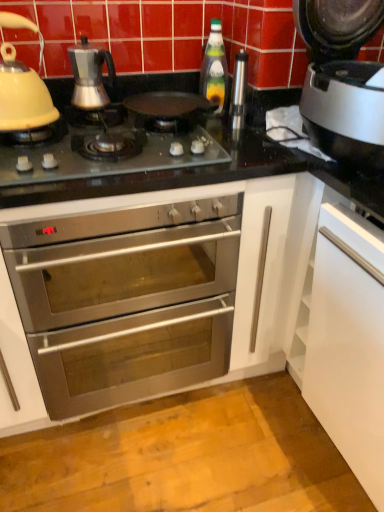
Consider the image. In order to face stainless steel oven at center, should I rotate leftwards or rightwards?

You should rotate left by 9.328 degrees.

Image resolution: width=384 pixels, height=512 pixels. What are the coordinates of `black glass gas stove at center` in the screenshot? It's located at (108, 150).

The width and height of the screenshot is (384, 512). What do you see at coordinates (90, 75) in the screenshot?
I see `satin silver coffee maker at upper left, which is counted as the first kitchen appliance, starting from the right` at bounding box center [90, 75].

This screenshot has height=512, width=384. In order to click on green glass bottle at center in this screenshot , I will do `click(214, 68)`.

This screenshot has width=384, height=512. I want to click on matte yellow kettle at left, the first kitchen appliance when ordered from left to right, so click(x=22, y=95).

This screenshot has width=384, height=512. Identify the location of white glossy dishwasher at lower right, the 2th appliance in the left-to-right sequence. (349, 343).

Considering the sizes of objects black glass gas stove at center and satin silver thermos at upper right, which ranks as the 1th appliance in left-to-right order, in the image provided, who is thinner, black glass gas stove at center or satin silver thermos at upper right, which ranks as the 1th appliance in left-to-right order,?

satin silver thermos at upper right, which ranks as the 1th appliance in left-to-right order, is thinner.

Can you confirm if black glass gas stove at center is smaller than satin silver thermos at upper right, acting as the 2th appliance starting from the right?

Actually, black glass gas stove at center might be larger than satin silver thermos at upper right, acting as the 2th appliance starting from the right.

Is black glass gas stove at center turned away from satin silver thermos at upper right, which ranks as the 1th appliance in left-to-right order?

No.

Between black glass gas stove at center and satin silver thermos at upper right, which ranks as the 1th appliance in left-to-right order, which one appears on the left side from the viewer's perspective?

From the viewer's perspective, black glass gas stove at center appears more on the left side.

How different are the orientations of satin silver thermos at upper right, the first appliance in the top-to-bottom sequence, and stainless steel oven at center in degrees?

They differ by 0.00612 degrees in their facing directions.

From a real-world perspective, is satin silver thermos at upper right, the 2th appliance in the bottom-to-top sequence, located beneath stainless steel oven at center?

No, from a real-world perspective, satin silver thermos at upper right, the 2th appliance in the bottom-to-top sequence, is not beneath stainless steel oven at center.

Is satin silver thermos at upper right, acting as the 2th appliance starting from the right, not inside stainless steel oven at center?

satin silver thermos at upper right, acting as the 2th appliance starting from the right, is positioned outside stainless steel oven at center.

Is satin silver thermos at upper right, acting as the 2th appliance starting from the right, next to stainless steel oven at center?

Result: No, satin silver thermos at upper right, acting as the 2th appliance starting from the right, is not with stainless steel oven at center.

Is stainless steel oven at center beside satin silver thermos at upper right, the first appliance in the top-to-bottom sequence?

There is a gap between stainless steel oven at center and satin silver thermos at upper right, the first appliance in the top-to-bottom sequence.

Looking at the image, does stainless steel oven at center seem bigger or smaller compared to satin silver thermos at upper right, acting as the 2th appliance starting from the right?

Clearly, stainless steel oven at center is larger in size than satin silver thermos at upper right, acting as the 2th appliance starting from the right.

Based on the photo, which object is further away from the camera, stainless steel oven at center or satin silver thermos at upper right, the first appliance in the top-to-bottom sequence?

Positioned behind is satin silver thermos at upper right, the first appliance in the top-to-bottom sequence.

Which object is positioned more to the right, stainless steel oven at center or satin silver thermos at upper right, acting as the 2th appliance starting from the right?

satin silver thermos at upper right, acting as the 2th appliance starting from the right.

Considering the relative positions of black glass gas stove at center and satin silver coffee maker at upper left, which is counted as the first kitchen appliance, starting from the right, in the image provided, is black glass gas stove at center in front of satin silver coffee maker at upper left, which is counted as the first kitchen appliance, starting from the right,?

Yes, it is.

Identify the location of gas stove below the satin silver coffee maker at upper left, which is the 2th kitchen appliance from left to right (from the image's perspective). (108, 150).

Is black glass gas stove at center far away from satin silver coffee maker at upper left, which is counted as the first kitchen appliance, starting from the right?

Actually, black glass gas stove at center and satin silver coffee maker at upper left, which is counted as the first kitchen appliance, starting from the right, are a little close together.

Who is smaller, matte yellow kettle at left, the first kitchen appliance when ordered from left to right, or black glass gas stove at center?

Smaller between the two is matte yellow kettle at left, the first kitchen appliance when ordered from left to right.

From the image's perspective, does matte yellow kettle at left, placed as the second kitchen appliance when sorted from right to left, appear lower than black glass gas stove at center?

Incorrect, from the image's perspective, matte yellow kettle at left, placed as the second kitchen appliance when sorted from right to left, is higher than black glass gas stove at center.

Between matte yellow kettle at left, the first kitchen appliance when ordered from left to right, and black glass gas stove at center, which one is positioned behind?

Positioned behind is matte yellow kettle at left, the first kitchen appliance when ordered from left to right.

Considering the sizes of matte yellow kettle at left, the first kitchen appliance when ordered from left to right, and black glass gas stove at center in the image, is matte yellow kettle at left, the first kitchen appliance when ordered from left to right, taller or shorter than black glass gas stove at center?

matte yellow kettle at left, the first kitchen appliance when ordered from left to right, is taller than black glass gas stove at center.

Is green glass bottle at center not near matte yellow kettle at left, placed as the second kitchen appliance when sorted from right to left?

No, green glass bottle at center is not far away from matte yellow kettle at left, placed as the second kitchen appliance when sorted from right to left.

From the image's perspective, is green glass bottle at center on top of matte yellow kettle at left, placed as the second kitchen appliance when sorted from right to left?

Correct, green glass bottle at center appears higher than matte yellow kettle at left, placed as the second kitchen appliance when sorted from right to left, in the image.

Is green glass bottle at center aimed at matte yellow kettle at left, placed as the second kitchen appliance when sorted from right to left?

No, green glass bottle at center does not turn towards matte yellow kettle at left, placed as the second kitchen appliance when sorted from right to left.

Would you say white glossy dishwasher at lower right, the second appliance viewed from the top, is inside or outside matte yellow kettle at left, placed as the second kitchen appliance when sorted from right to left?

white glossy dishwasher at lower right, the second appliance viewed from the top, is spatially situated outside matte yellow kettle at left, placed as the second kitchen appliance when sorted from right to left.

Which of these two, white glossy dishwasher at lower right, the 1th appliance in the bottom-to-top sequence, or matte yellow kettle at left, placed as the second kitchen appliance when sorted from right to left, is thinner?

matte yellow kettle at left, placed as the second kitchen appliance when sorted from right to left.

From the image's perspective, would you say white glossy dishwasher at lower right, the 2th appliance in the left-to-right sequence, is positioned over matte yellow kettle at left, placed as the second kitchen appliance when sorted from right to left?

No.

You are a GUI agent. You are given a task and a screenshot of the screen. Output one action in this format:
    pyautogui.click(x=<x>, y=<y>)
    Task: Click on the appliance behind the black glass gas stove at center
    This screenshot has height=512, width=384.
    Given the screenshot: What is the action you would take?
    pyautogui.click(x=239, y=91)

Where is `cabinetry on the left of satin silver thermos at upper right, the 2th appliance in the bottom-to-top sequence`? cabinetry on the left of satin silver thermos at upper right, the 2th appliance in the bottom-to-top sequence is located at coordinates (148, 298).

Which object lies further to the anchor point matte yellow kettle at left, placed as the second kitchen appliance when sorted from right to left, satin silver coffee maker at upper left, which is the 2th kitchen appliance from left to right, or white glossy dishwasher at lower right, marked as the 1th appliance in a right-to-left arrangement?

white glossy dishwasher at lower right, marked as the 1th appliance in a right-to-left arrangement.

Estimate the real-world distances between objects in this image. Which object is further from stainless steel oven at center, black glass gas stove at center or satin silver thermos at upper right, acting as the 2th appliance starting from the right?

→ Based on the image, satin silver thermos at upper right, acting as the 2th appliance starting from the right, appears to be further to stainless steel oven at center.

Based on their spatial positions, is matte yellow kettle at left, the first kitchen appliance when ordered from left to right, or black glass gas stove at center closer to white glossy dishwasher at lower right, the 1th appliance in the bottom-to-top sequence?

The object closer to white glossy dishwasher at lower right, the 1th appliance in the bottom-to-top sequence, is black glass gas stove at center.

Based on their spatial positions, is white glossy dishwasher at lower right, the 2th appliance in the left-to-right sequence, or green glass bottle at center closer to stainless steel oven at center?

The object closer to stainless steel oven at center is white glossy dishwasher at lower right, the 2th appliance in the left-to-right sequence.

Estimate the real-world distances between objects in this image. Which object is closer to stainless steel oven at center, satin silver coffee maker at upper left, which is the 2th kitchen appliance from left to right, or white glossy dishwasher at lower right, the 1th appliance in the bottom-to-top sequence?

The object closer to stainless steel oven at center is white glossy dishwasher at lower right, the 1th appliance in the bottom-to-top sequence.

When comparing their distances from white glossy dishwasher at lower right, marked as the 1th appliance in a right-to-left arrangement, does satin silver thermos at upper right, the first appliance in the top-to-bottom sequence, or green glass bottle at center seem further?

green glass bottle at center lies further to white glossy dishwasher at lower right, marked as the 1th appliance in a right-to-left arrangement, than the other object.

Based on their spatial positions, is stainless steel oven at center or matte yellow kettle at left, placed as the second kitchen appliance when sorted from right to left, further from satin silver coffee maker at upper left, which is counted as the first kitchen appliance, starting from the right?

stainless steel oven at center is further to satin silver coffee maker at upper left, which is counted as the first kitchen appliance, starting from the right.

Based on their spatial positions, is satin silver coffee maker at upper left, which is counted as the first kitchen appliance, starting from the right, or matte yellow kettle at left, placed as the second kitchen appliance when sorted from right to left, closer to stainless steel oven at center?

matte yellow kettle at left, placed as the second kitchen appliance when sorted from right to left, is closer to stainless steel oven at center.

Identify the location of gas stove situated between satin silver coffee maker at upper left, which is counted as the first kitchen appliance, starting from the right, and green glass bottle at center from left to right. The image size is (384, 512). (108, 150).

Where is `gas stove between matte yellow kettle at left, placed as the second kitchen appliance when sorted from right to left, and green glass bottle at center from left to right`? gas stove between matte yellow kettle at left, placed as the second kitchen appliance when sorted from right to left, and green glass bottle at center from left to right is located at coordinates (108, 150).

Where is `cabinetry between satin silver coffee maker at upper left, which is counted as the first kitchen appliance, starting from the right, and white glossy dishwasher at lower right, the 2th appliance in the left-to-right sequence, in the horizontal direction`? Image resolution: width=384 pixels, height=512 pixels. cabinetry between satin silver coffee maker at upper left, which is counted as the first kitchen appliance, starting from the right, and white glossy dishwasher at lower right, the 2th appliance in the left-to-right sequence, in the horizontal direction is located at coordinates (148, 298).

At what (x,y) coordinates should I click in order to perform the action: click on kitchen appliance between satin silver thermos at upper right, acting as the 2th appliance starting from the right, and stainless steel oven at center in the up-down direction. Please return your answer as a coordinate pair (x, y). Image resolution: width=384 pixels, height=512 pixels. Looking at the image, I should click on (22, 95).